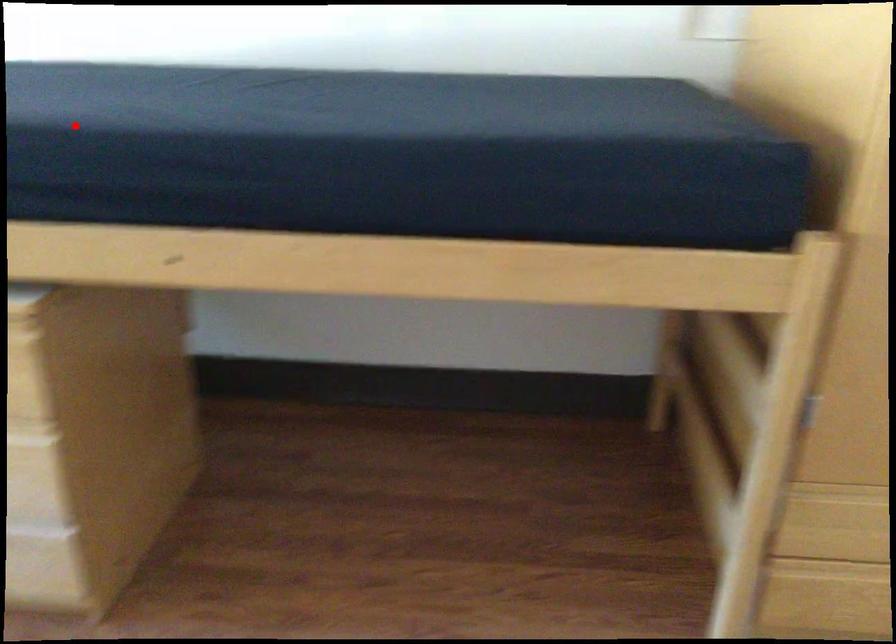
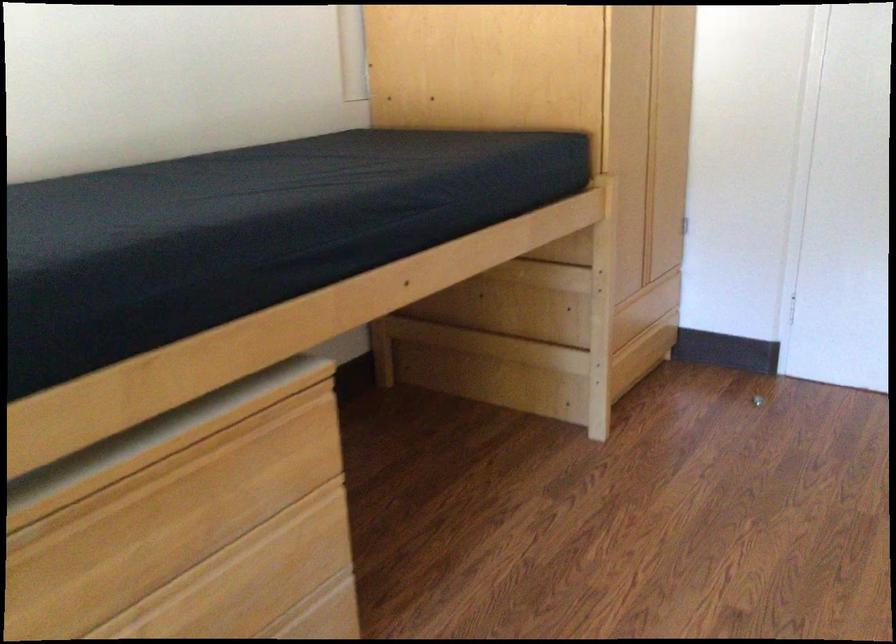
Question: I am providing you with two images of the same scene from different viewpoints. A red point is marked on the first image. Is the red point's position out of view in image 2?

Choices:
 (A) Yes
 (B) No

Answer: (B)